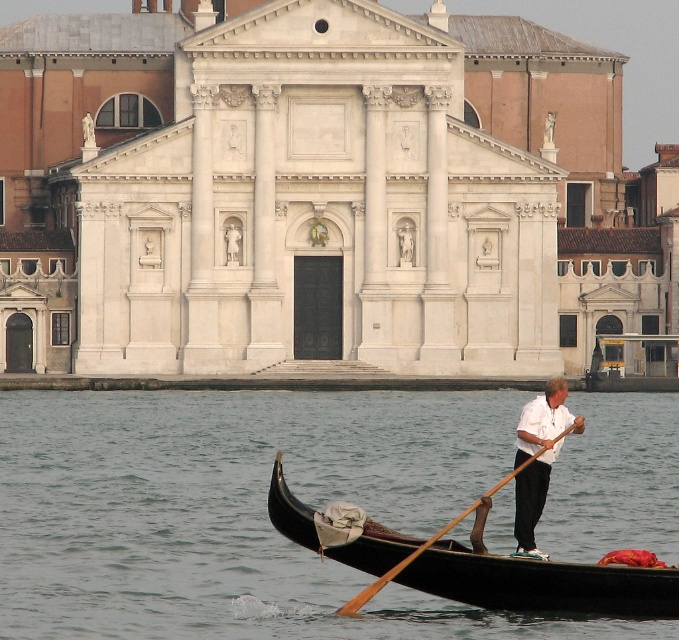
Can you confirm if transparent water at lower center is taller than white cotton shirt at center?

Yes, transparent water at lower center is taller than white cotton shirt at center.

Does transparent water at lower center appear under white cotton shirt at center?

Yes.

Does point (583, 525) lie in front of point (555, 408)?

No, (583, 525) is further to viewer.

Find the location of a particular element. Image resolution: width=679 pixels, height=640 pixels. transparent water at lower center is located at coordinates pyautogui.click(x=240, y=512).

Measure the distance from transparent water at lower center to brown wood paddle at lower center.

A distance of 37.49 feet exists between transparent water at lower center and brown wood paddle at lower center.

Between point (598, 636) and point (466, 513), which one is positioned in front?

Point (598, 636) is in front.

I want to click on transparent water at lower center, so click(x=240, y=512).

Is point (532, 420) closer to viewer compared to point (447, 524)?

Yes.

Is white cotton shirt at center smaller than brown wood paddle at lower center?

Yes.

Is point (536, 410) closer to viewer compared to point (405, 557)?

No, (536, 410) is further to viewer.

Find the location of a particular element. The image size is (679, 640). white cotton shirt at center is located at coordinates (538, 456).